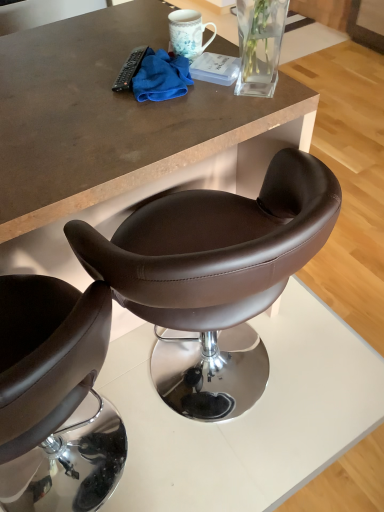
Image resolution: width=384 pixels, height=512 pixels. Find the location of `empty space that is ontop of matte brown leather stool at center (from a real-world perspective)`. empty space that is ontop of matte brown leather stool at center (from a real-world perspective) is located at coordinates (76, 83).